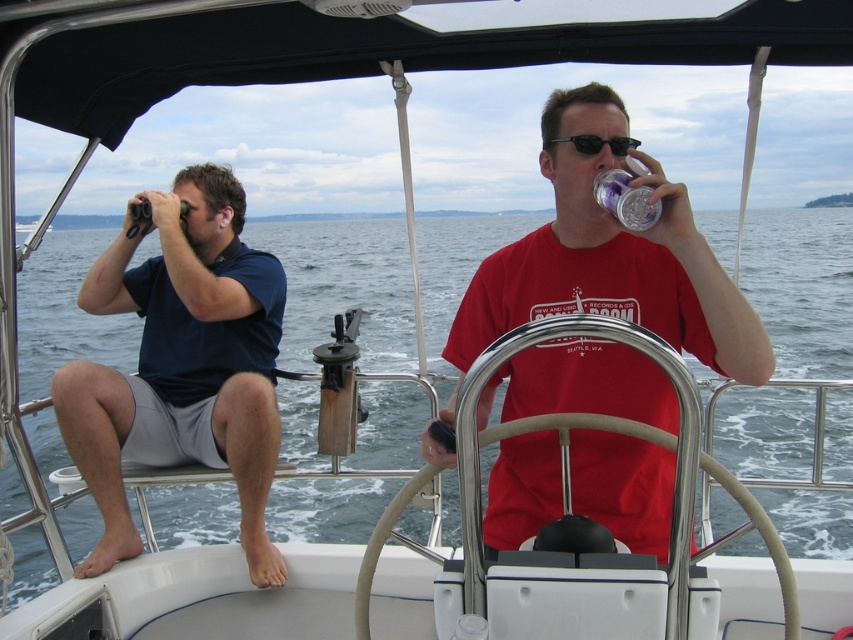
You are on a boat and need to place a new item between the dark blue shirt at left and the clear plastic cup at upper right. Which object should you place it closer to if you want the item to be closer to the taller object?

The dark blue shirt at left is taller than the clear plastic cup at upper right, so you should place the new item closer to the dark blue shirt at left to ensure it is near the taller object.